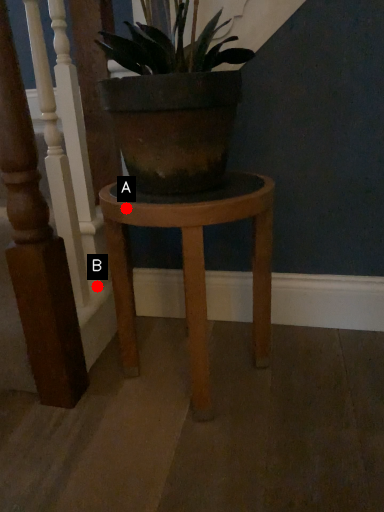
Question: Two points are circled on the image, labeled by A and B beside each circle. Which point is farther to the camera?

Choices:
 (A) A is further
 (B) B is further

Answer: (B)